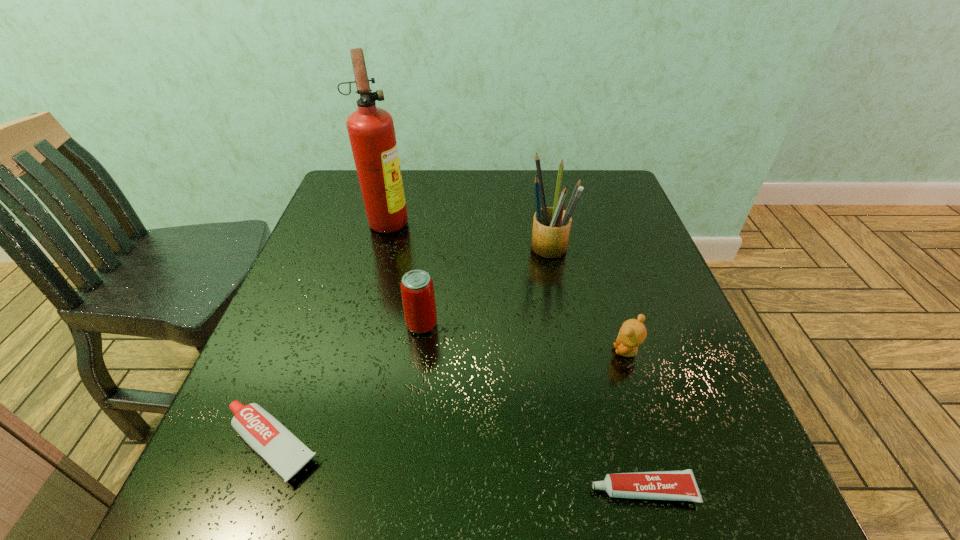
In the image, there is a desktop. Identify the location of vacant area at the left edge. The image size is (960, 540). (276, 334).

This screenshot has height=540, width=960. Identify the location of free space at the right edge. (718, 446).

Identify the location of vacant space at the far right corner of the desktop. (588, 175).

I want to click on free space between the pencil box and the fire extinguisher, so click(x=468, y=234).

Image resolution: width=960 pixels, height=540 pixels. I want to click on free space between the fire extinguisher and the fourth shortest object, so click(x=405, y=272).

The height and width of the screenshot is (540, 960). Find the location of `empty space between the left toothpaste and the teddy bear`. empty space between the left toothpaste and the teddy bear is located at coordinates (449, 398).

Identify the location of free space between the third nearest object and the tallest object. (508, 286).

Where is `free space between the left toothpaste and the fifth shortest object`? This screenshot has height=540, width=960. free space between the left toothpaste and the fifth shortest object is located at coordinates (410, 346).

Where is `free space between the right toothpaste and the left toothpaste`? This screenshot has height=540, width=960. free space between the right toothpaste and the left toothpaste is located at coordinates (457, 468).

Where is `vacant space in between the right toothpaste and the teddy bear`? vacant space in between the right toothpaste and the teddy bear is located at coordinates (635, 421).